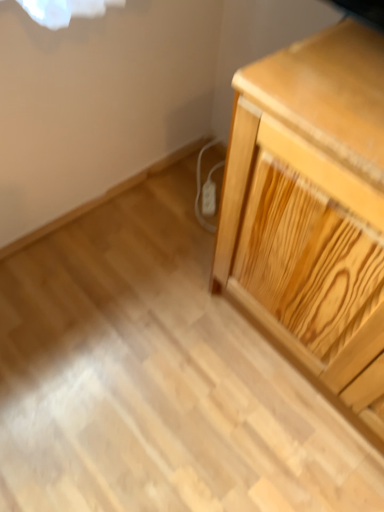
I want to click on free space in front of white plastic electric outlet at lower center, so click(188, 230).